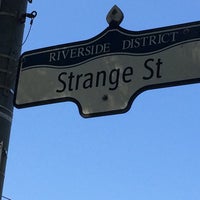
You are a GUI agent. You are given a task and a screenshot of the screen. Output one action in this format:
    pyautogui.click(x=<x>, y=<y>)
    Task: Click on the cord
    
    Given the screenshot: What is the action you would take?
    pyautogui.click(x=33, y=13)